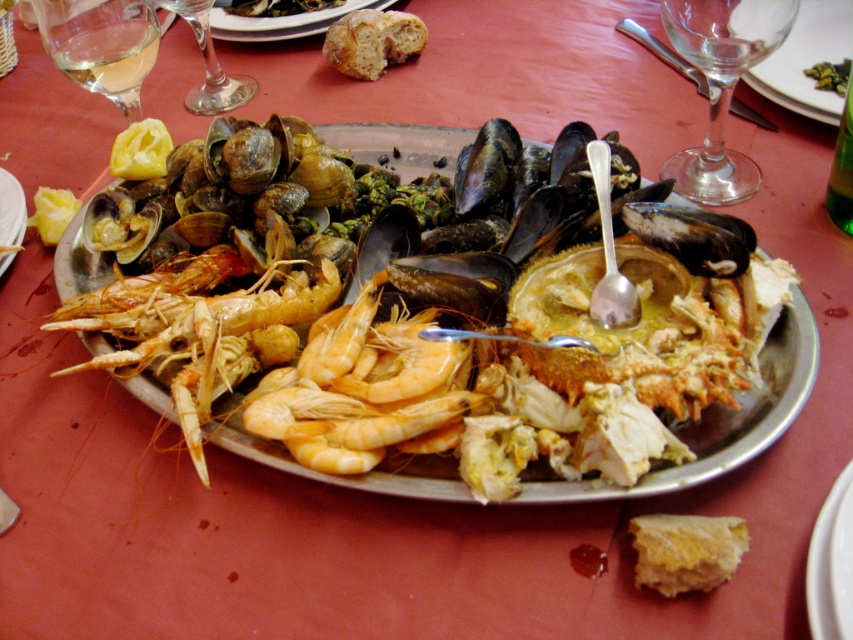
Can you confirm if pale orange shrimp at center is positioned to the left of transparent glass at upper center?

Indeed, pale orange shrimp at center is positioned on the left side of transparent glass at upper center.

Who is shorter, pale orange shrimp at center or transparent glass at upper center?

With less height is transparent glass at upper center.

The image size is (853, 640). Identify the location of pale orange shrimp at center. (360, 388).

In order to click on metallic silver platter at center in this screenshot , I will do `click(718, 420)`.

Which is in front, point (171, 401) or point (431, 356)?

Point (431, 356) is in front.

This screenshot has height=640, width=853. What do you see at coordinates (718, 420) in the screenshot?
I see `metallic silver platter at center` at bounding box center [718, 420].

This screenshot has height=640, width=853. I want to click on metallic silver platter at center, so click(718, 420).

In the scene shown: Between metallic silver platter at center and transparent glass at upper center, which one has less height?

Standing shorter between the two is transparent glass at upper center.

Measure the distance from metallic silver platter at center to transparent glass at upper center.

They are 11.00 inches apart.

At what (x,y) coordinates should I click in order to perform the action: click on metallic silver platter at center. Please return your answer as a coordinate pair (x, y). This screenshot has height=640, width=853. Looking at the image, I should click on (718, 420).

Find the location of a particular element. Image resolution: width=853 pixels, height=640 pixels. metallic silver platter at center is located at coordinates (718, 420).